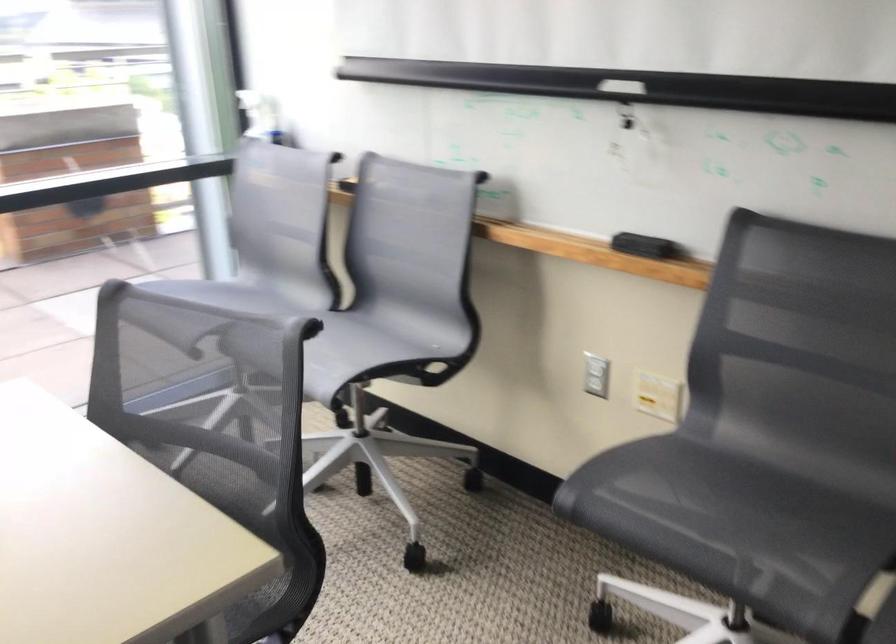
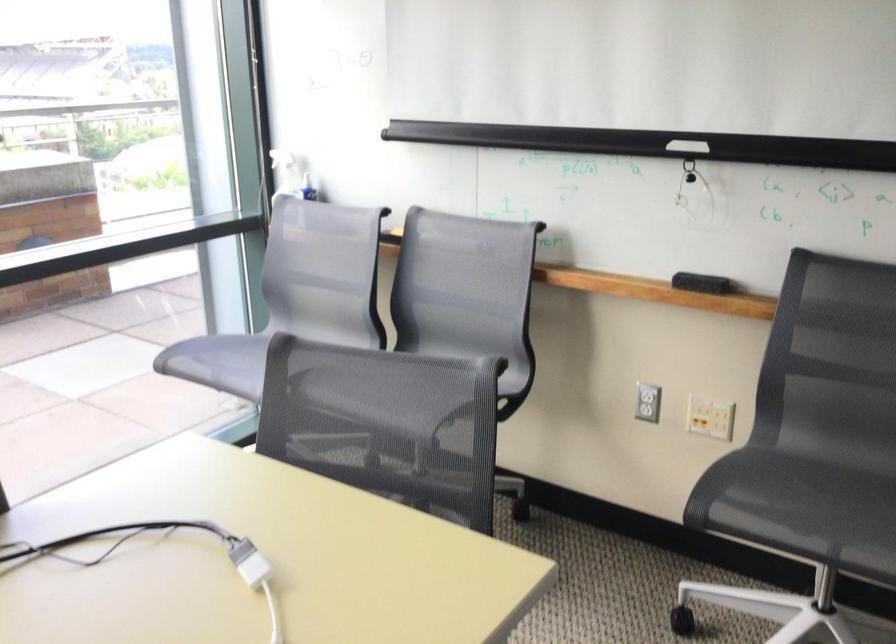
Find the pixel in the second image that matches the point at 645,245 in the first image.

(701, 283)